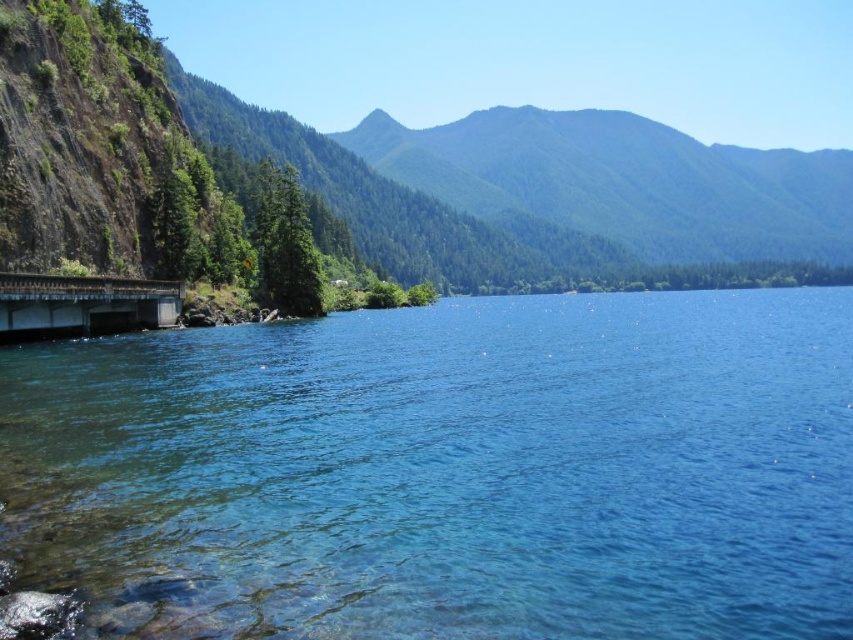
You are standing at the center of the image and want to reach the clear blue water at lower left. Which direction should you move to get there?

You should move towards the lower left direction to reach the clear blue water at lower left, as it is located at point (445, 472).

You are standing on the bridge at the edge of the cliff and looking towards the center of the image. Which object, the clear blue water at lower left or the green forested mountain at upper center, appears narrower from your perspective?

The clear blue water at lower left appears narrower than the green forested mountain at upper center because the description states that it is thinner.